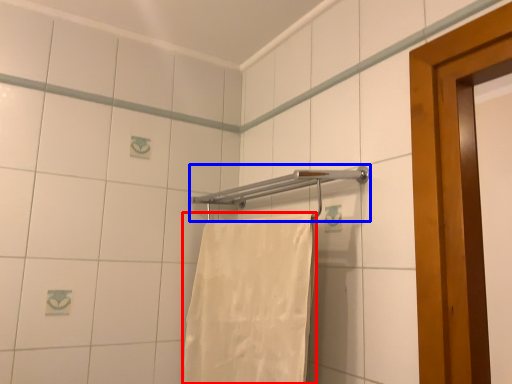
Question: Among these objects, which one is farthest to the camera, towel (highlighted by a red box) or towel bar (highlighted by a blue box)?

Choices:
 (A) towel
 (B) towel bar

Answer: (B)